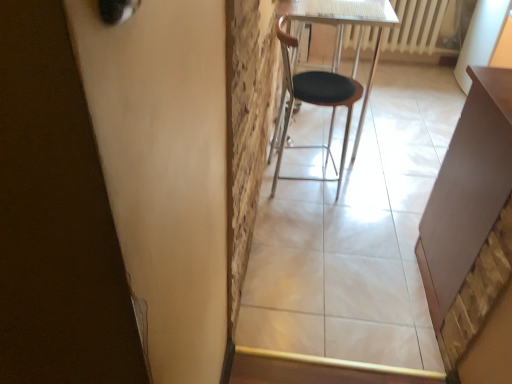
Question: Is black leather chair at center not inside matte brown table at right?

Choices:
 (A) no
 (B) yes

Answer: (B)

Question: Considering the relative positions of black leather chair at center and matte brown table at right in the image provided, is black leather chair at center in front of matte brown table at right?

Choices:
 (A) no
 (B) yes

Answer: (A)

Question: Is black leather chair at center far away from matte brown table at right?

Choices:
 (A) no
 (B) yes

Answer: (A)

Question: From a real-world perspective, is black leather chair at center on top of matte brown table at right?

Choices:
 (A) yes
 (B) no

Answer: (B)

Question: Is black leather chair at center aimed at matte brown table at right?

Choices:
 (A) no
 (B) yes

Answer: (A)

Question: Is black leather chair at center positioned with its back to matte brown table at right?

Choices:
 (A) no
 (B) yes

Answer: (A)

Question: From the image's perspective, is matte brown table at right located beneath black leather chair at center?

Choices:
 (A) yes
 (B) no

Answer: (A)

Question: Is matte brown table at right shorter than black leather chair at center?

Choices:
 (A) no
 (B) yes

Answer: (A)

Question: Considering the relative sizes of matte brown table at right and black leather chair at center in the image provided, is matte brown table at right wider than black leather chair at center?

Choices:
 (A) yes
 (B) no

Answer: (A)

Question: Can you confirm if matte brown table at right is smaller than black leather chair at center?

Choices:
 (A) yes
 (B) no

Answer: (B)

Question: Is matte brown table at right behind black leather chair at center?

Choices:
 (A) no
 (B) yes

Answer: (A)

Question: Is matte brown table at right next to black leather chair at center and touching it?

Choices:
 (A) yes
 (B) no

Answer: (B)

Question: Does white plastic radiator at upper right come behind black leather chair at center?

Choices:
 (A) no
 (B) yes

Answer: (B)